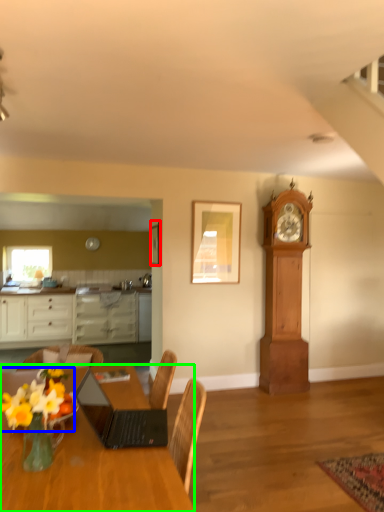
Question: Which is nearer to the picture frame (highlighted by a red box)? flower (highlighted by a blue box) or desk (highlighted by a green box).

Choices:
 (A) flower
 (B) desk

Answer: (B)